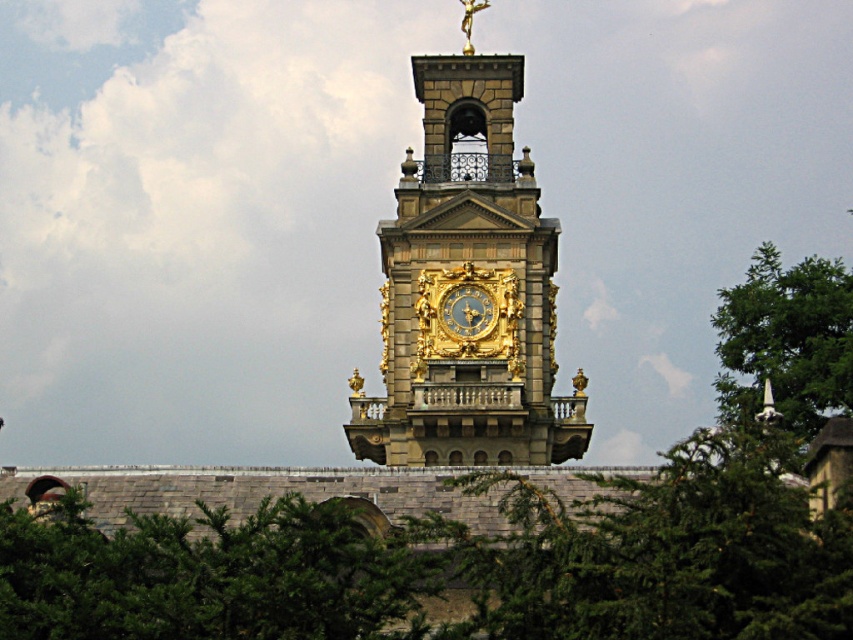
Can you confirm if green leafy tree at right is taller than gold ornate clock at center?

Correct, green leafy tree at right is much taller as gold ornate clock at center.

Does green leafy tree at right lie in front of gold ornate clock at center?

Yes, green leafy tree at right is in front of gold ornate clock at center.

Between point (840, 340) and point (463, 300), which one is positioned behind?

Positioned behind is point (463, 300).

Locate an element on the screen. green leafy tree at right is located at coordinates (786, 340).

Is point (505, 140) farther from viewer compared to point (439, 307)?

Yes, it is behind point (439, 307).

Is the position of gold ornate clock tower at center more distant than that of gold ornate clock at center?

No, gold ornate clock tower at center is in front of gold ornate clock at center.

At what (x,y) coordinates should I click in order to perform the action: click on gold ornate clock tower at center. Please return your answer as a coordinate pair (x, y). Image resolution: width=853 pixels, height=640 pixels. Looking at the image, I should click on (466, 284).

Based on the photo, is gold ornate clock tower at center positioned in front of green leafy tree at right?

No, it is behind green leafy tree at right.

Which of these two, gold ornate clock tower at center or green leafy tree at right, stands shorter?

green leafy tree at right

Where is `gold ornate clock tower at center`? This screenshot has width=853, height=640. gold ornate clock tower at center is located at coordinates (466, 284).